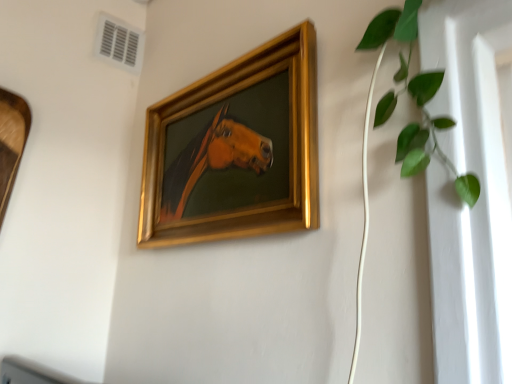
Question: Is point (x=411, y=129) positioned closer to the camera than point (x=143, y=155)?

Choices:
 (A) farther
 (B) closer

Answer: (B)

Question: From the image's perspective, is green leafy plant at upper right positioned above or below gold/gilded picture frame at center?

Choices:
 (A) above
 (B) below

Answer: (A)

Question: Which is farther from the green leafy plant at upper right?

Choices:
 (A) white plastic air conditioning at upper left
 (B) gold/gilded picture frame at center

Answer: (A)

Question: Which of these objects is positioned closest to the gold/gilded picture frame at center?

Choices:
 (A) green leafy plant at upper right
 (B) white plastic air conditioning at upper left

Answer: (A)